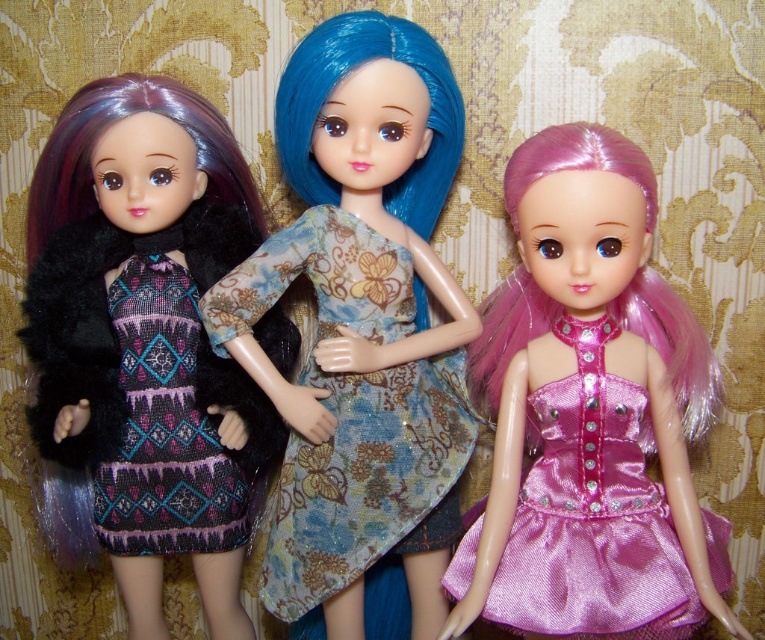
Question: Which of the following is the closest to the observer?

Choices:
 (A) (235, 524)
 (B) (612, 620)
 (C) (140, 333)
 (D) (389, 372)

Answer: (B)

Question: Is shiny floral dress at center below shiny black fur coat at left?

Choices:
 (A) yes
 (B) no

Answer: (B)

Question: Is shiny floral dress at center behind shiny pink satin dress at right?

Choices:
 (A) no
 (B) yes

Answer: (B)

Question: Which object is the farthest from the shiny pink satin dress at right?

Choices:
 (A) patterned fabric dress at left
 (B) shiny floral dress at center

Answer: (A)

Question: Is shiny black fur coat at left above shiny pink satin dress at right?

Choices:
 (A) no
 (B) yes

Answer: (B)

Question: Among these points, which one is nearest to the camera?

Choices:
 (A) (187, 460)
 (B) (331, 96)
 (C) (153, 96)

Answer: (B)